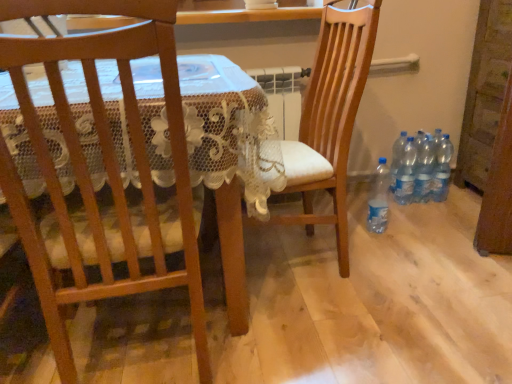
Find the location of a particular element. free location to the right of clear plastic bottles at lower right, acting as the 2th bottle starting from the right is located at coordinates (458, 200).